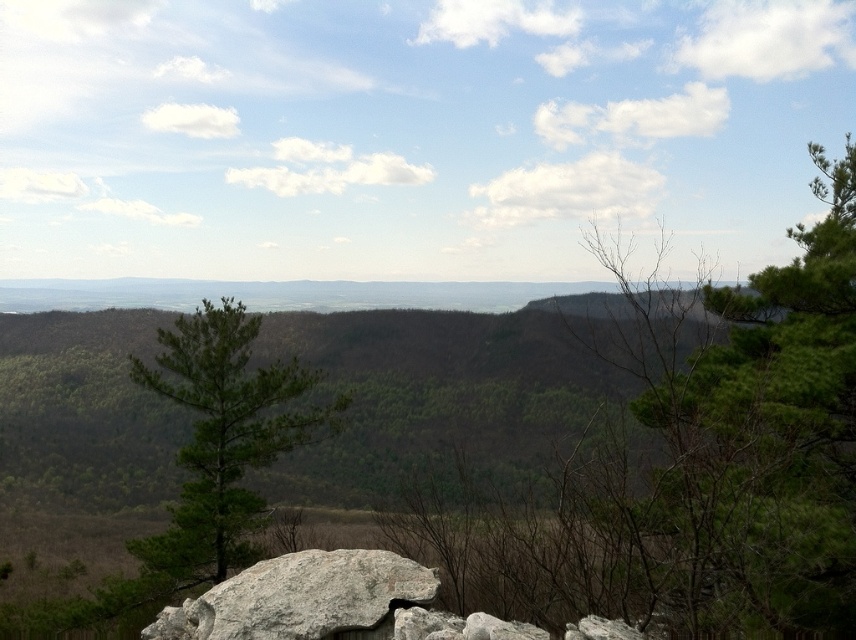
Can you confirm if green leafy tree at center is positioned to the left of gray rough rock at lower center?

No, green leafy tree at center is not to the left of gray rough rock at lower center.

Is green leafy tree at center taller than gray rough rock at lower center?

Yes.

The image size is (856, 640). What do you see at coordinates (712, 458) in the screenshot?
I see `green leafy tree at center` at bounding box center [712, 458].

Locate an element on the screen. This screenshot has height=640, width=856. green leafy tree at center is located at coordinates (712, 458).

Can you confirm if green matte tree at center is smaller than gray rough rock at lower center?

No, green matte tree at center is not smaller than gray rough rock at lower center.

Does green matte tree at center have a lesser width compared to gray rough rock at lower center?

No, green matte tree at center is not thinner than gray rough rock at lower center.

Does point (342, 404) lie behind point (336, 620)?

Yes, it is behind point (336, 620).

The image size is (856, 640). I want to click on green matte tree at center, so click(223, 440).

Is the position of green leafy tree at center more distant than that of green matte tree at center?

No.

Which is more to the left, green leafy tree at center or green matte tree at center?

green matte tree at center is more to the left.

Who is more distant from viewer, (495, 561) or (278, 424)?

Point (278, 424)

The width and height of the screenshot is (856, 640). Find the location of `green leafy tree at center`. green leafy tree at center is located at coordinates [712, 458].